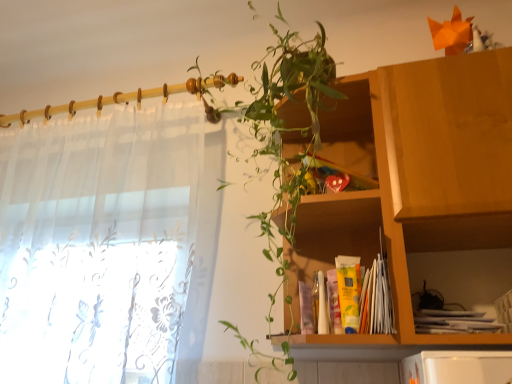
Question: Considering the relative sizes of green leafy plant at upper center and sheer white curtain at left in the image provided, is green leafy plant at upper center taller than sheer white curtain at left?

Choices:
 (A) no
 (B) yes

Answer: (B)

Question: Does green leafy plant at upper center appear on the left side of sheer white curtain at left?

Choices:
 (A) yes
 (B) no

Answer: (B)

Question: Is green leafy plant at upper center at the right side of sheer white curtain at left?

Choices:
 (A) no
 (B) yes

Answer: (B)

Question: Is green leafy plant at upper center positioned in front of sheer white curtain at left?

Choices:
 (A) no
 (B) yes

Answer: (B)

Question: Can you confirm if green leafy plant at upper center is shorter than sheer white curtain at left?

Choices:
 (A) no
 (B) yes

Answer: (A)

Question: In the image, is sheer white curtain at left on the left side or the right side of wooden cabinet at center?

Choices:
 (A) left
 (B) right

Answer: (A)

Question: Do you think sheer white curtain at left is within wooden cabinet at center, or outside of it?

Choices:
 (A) outside
 (B) inside

Answer: (A)

Question: Considering their positions, is sheer white curtain at left located in front of or behind wooden cabinet at center?

Choices:
 (A) front
 (B) behind

Answer: (A)

Question: From a real-world perspective, relative to wooden cabinet at center, is sheer white curtain at left vertically above or below?

Choices:
 (A) below
 (B) above

Answer: (A)

Question: Considering the positions of point (497, 82) and point (276, 130), is point (497, 82) closer or farther from the camera than point (276, 130)?

Choices:
 (A) closer
 (B) farther

Answer: (A)

Question: From a real-world perspective, is wooden cabinet at upper right physically located above or below green leafy plant at upper center?

Choices:
 (A) below
 (B) above

Answer: (A)

Question: Based on their sizes in the image, would you say wooden cabinet at upper right is bigger or smaller than green leafy plant at upper center?

Choices:
 (A) small
 (B) big

Answer: (A)

Question: Which is correct: wooden cabinet at upper right is inside green leafy plant at upper center, or outside of it?

Choices:
 (A) inside
 (B) outside

Answer: (B)

Question: From a real-world perspective, is wooden cabinet at upper right physically located above or below sheer white curtain at left?

Choices:
 (A) below
 (B) above

Answer: (A)

Question: Considering the positions of wooden cabinet at upper right and sheer white curtain at left in the image, is wooden cabinet at upper right bigger or smaller than sheer white curtain at left?

Choices:
 (A) small
 (B) big

Answer: (A)